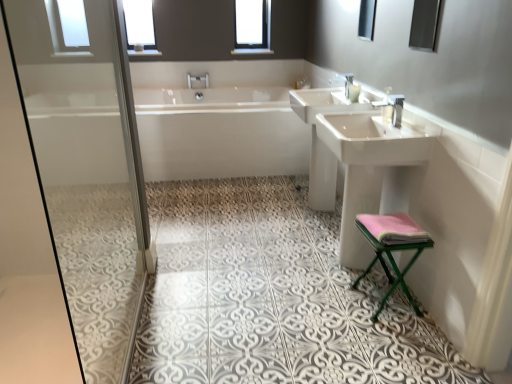
The height and width of the screenshot is (384, 512). Describe the element at coordinates (362, 167) in the screenshot. I see `white glossy sink at right, acting as the first sink starting from the front` at that location.

I want to click on matte glass mirror at upper right, which is counted as the second mirror, starting from the back, so click(425, 25).

How much space does white glass window at upper left, the first window when ordered from left to right, occupy horizontally?

white glass window at upper left, the first window when ordered from left to right, is 1.34 inches wide.

What are the coordinates of `silver metallic tap at upper center, the 1th tap in the right-to-left sequence` in the screenshot? It's located at (391, 108).

This screenshot has width=512, height=384. What do you see at coordinates (391, 108) in the screenshot?
I see `silver metallic tap at upper center, the first tap in the front-to-back sequence` at bounding box center [391, 108].

This screenshot has width=512, height=384. In order to click on white glossy sink at right, acting as the first sink starting from the front in this screenshot , I will do `click(362, 167)`.

From a real-world perspective, is silver metallic tap at upper center, which ranks as the 2th tap in left-to-right order, on top of clear glass window at upper center, the 1th window from the right?

Incorrect, from a real-world perspective, silver metallic tap at upper center, which ranks as the 2th tap in left-to-right order, is lower than clear glass window at upper center, the 1th window from the right.

Are silver metallic tap at upper center, which ranks as the 2th tap in left-to-right order, and clear glass window at upper center, marked as the 2th window in a left-to-right arrangement, located far from each other?

Yes, silver metallic tap at upper center, which ranks as the 2th tap in left-to-right order, and clear glass window at upper center, marked as the 2th window in a left-to-right arrangement, are located far from each other.

Is silver metallic tap at upper center, which is the 1th tap in bottom-to-top order, oriented away from clear glass window at upper center, the 1th window from the right?

No.

Is silver metallic tap at upper center, the first tap in the front-to-back sequence, shorter than clear glass window at upper center, the 1th window from the right?

Yes.

Locate an element on the screen. This screenshot has height=384, width=512. mirror located behind the silver metallic tap at upper center, which ranks as the 2th tap in left-to-right order is located at coordinates (367, 19).

Is silver metallic tap at upper center, positioned as the 2th tap in top-to-bottom order, facing towards glossy glass mirror at upper center, which is the first mirror in left-to-right order?

No, silver metallic tap at upper center, positioned as the 2th tap in top-to-bottom order, does not turn towards glossy glass mirror at upper center, which is the first mirror in left-to-right order.

What's the angular difference between silver metallic tap at upper center, the 1th tap in the right-to-left sequence, and glossy glass mirror at upper center, positioned as the first mirror in back-to-front order,'s facing directions?

silver metallic tap at upper center, the 1th tap in the right-to-left sequence, and glossy glass mirror at upper center, positioned as the first mirror in back-to-front order, are facing 0.678 degrees away from each other.

Which point is more forward, (396, 281) or (369, 6)?

Point (396, 281)

Considering the relative sizes of pink fabric stool at lower right and glossy glass mirror at upper center, which is the first mirror in left-to-right order, in the image provided, is pink fabric stool at lower right wider than glossy glass mirror at upper center, which is the first mirror in left-to-right order,?

Indeed, pink fabric stool at lower right has a greater width compared to glossy glass mirror at upper center, which is the first mirror in left-to-right order.

Between pink fabric stool at lower right and glossy glass mirror at upper center, the first mirror viewed from the top, which one has smaller size?

glossy glass mirror at upper center, the first mirror viewed from the top.

From the picture: From a real-world perspective, relative to glossy glass mirror at upper center, marked as the second mirror in a bottom-to-top arrangement, is pink fabric stool at lower right vertically above or below?

In terms of real-world spatial position, pink fabric stool at lower right is below glossy glass mirror at upper center, marked as the second mirror in a bottom-to-top arrangement.

Considering the relative sizes of glossy glass mirror at upper center, which ranks as the 2th mirror in right-to-left order, and pink fabric stool at lower right in the image provided, is glossy glass mirror at upper center, which ranks as the 2th mirror in right-to-left order, thinner than pink fabric stool at lower right?

Correct, the width of glossy glass mirror at upper center, which ranks as the 2th mirror in right-to-left order, is less than that of pink fabric stool at lower right.

Between glossy glass mirror at upper center, marked as the second mirror in a bottom-to-top arrangement, and pink fabric stool at lower right, which one has larger size?

With larger size is pink fabric stool at lower right.

Would you say glossy glass mirror at upper center, the first mirror viewed from the top, is to the left or to the right of pink fabric stool at lower right in the picture?

In the image, glossy glass mirror at upper center, the first mirror viewed from the top, appears on the right side of pink fabric stool at lower right.

From a real-world perspective, between white textured tile at center and silver metallic tap at upper center, positioned as the 2th tap in top-to-bottom order, who is vertically lower?

From a 3D spatial view, white textured tile at center is below.

In the scene shown: Is white textured tile at center bigger than silver metallic tap at upper center, the 1th tap in the right-to-left sequence?

Yes.

Considering the relative sizes of white textured tile at center and silver metallic tap at upper center, which appears as the second tap when viewed from the back, in the image provided, is white textured tile at center taller than silver metallic tap at upper center, which appears as the second tap when viewed from the back,?

No.

In terms of height, does white glossy sink at center, arranged as the 2th sink when viewed from the front, look taller or shorter compared to clear glass window at upper center, the 1th window from the right?

Clearly, white glossy sink at center, arranged as the 2th sink when viewed from the front, is taller compared to clear glass window at upper center, the 1th window from the right.

Considering the positions of objects white glossy sink at center, arranged as the 2th sink when viewed from the front, and clear glass window at upper center, the 1th window from the right, in the image provided, who is more to the right, white glossy sink at center, arranged as the 2th sink when viewed from the front, or clear glass window at upper center, the 1th window from the right,?

From the viewer's perspective, white glossy sink at center, arranged as the 2th sink when viewed from the front, appears more on the right side.

From the image's perspective, is white glossy sink at center, arranged as the first sink when viewed from the back, under clear glass window at upper center, the 1th window from the right?

Correct, white glossy sink at center, arranged as the first sink when viewed from the back, appears lower than clear glass window at upper center, the 1th window from the right, in the image.

Choose the correct answer: Is white glossy sink at center, arranged as the first sink when viewed from the back, inside clear glass window at upper center, marked as the 2th window in a left-to-right arrangement, or outside it?

white glossy sink at center, arranged as the first sink when viewed from the back, is not inside clear glass window at upper center, marked as the 2th window in a left-to-right arrangement, it's outside.

From a real-world perspective, is pink fabric stool at lower right positioned above or below silver metallic tap at upper center, arranged as the 2th tap when ordered from the bottom?

pink fabric stool at lower right is situated lower than silver metallic tap at upper center, arranged as the 2th tap when ordered from the bottom, in the real world.

Is point (384, 261) more distant than point (198, 79)?

No, it is in front of (198, 79).

From the image's perspective, would you say pink fabric stool at lower right is positioned over silver metallic tap at upper center, which is the 2th tap from right to left?

No, from the image's perspective, pink fabric stool at lower right is not over silver metallic tap at upper center, which is the 2th tap from right to left.

Which window is the 1st one when counting from the left side of the silver metallic tap at upper center, which appears as the second tap when viewed from the back? Please provide its 2D coordinates.

[(252, 27)]

Where is `tap that appears on the right of glossy glass mirror at upper center, the first mirror viewed from the top`? The image size is (512, 384). tap that appears on the right of glossy glass mirror at upper center, the first mirror viewed from the top is located at coordinates (391, 108).

Considering their positions, is clear glass window at upper center, marked as the 2th window in a left-to-right arrangement, positioned closer to pink fabric stool at lower right than white glossy sink at center, arranged as the 2th sink when viewed from the front?

The object closer to pink fabric stool at lower right is white glossy sink at center, arranged as the 2th sink when viewed from the front.

From the image, which object appears to be farther from matte glass mirror at upper right, positioned as the 2th mirror in left-to-right order, white glossy sink at center, arranged as the first sink when viewed from the back, or clear glass window at upper center, the 1th window from the right?

Among the two, clear glass window at upper center, the 1th window from the right, is located further to matte glass mirror at upper right, positioned as the 2th mirror in left-to-right order.

Looking at the image, which one is located closer to white glass window at upper left, the first window when ordered from left to right, silver metallic tap at upper center, the 1th tap in the right-to-left sequence, or white textured tile at center?

white textured tile at center is closer to white glass window at upper left, the first window when ordered from left to right.

Based on their spatial positions, is matte glass mirror at upper right, which is the 1th mirror from bottom to top, or silver metallic tap at upper center, arranged as the 2th tap when ordered from the bottom, closer to white glossy bathtub at center?

silver metallic tap at upper center, arranged as the 2th tap when ordered from the bottom, lies closer to white glossy bathtub at center than the other object.

Estimate the real-world distances between objects in this image. Which object is closer to white glossy bathtub at center, silver metallic tap at upper center, which ranks as the 2th tap in left-to-right order, or white textured tile at center?

Based on the image, white textured tile at center appears to be nearer to white glossy bathtub at center.

From the image, which object appears to be nearer to silver metallic tap at upper center, which is the first tap in left-to-right order, white glossy sink at center, arranged as the 2th sink when viewed from the front, or clear glass window at upper center, marked as the 2th window in a left-to-right arrangement?

Among the two, clear glass window at upper center, marked as the 2th window in a left-to-right arrangement, is located nearer to silver metallic tap at upper center, which is the first tap in left-to-right order.

Looking at the image, which one is located further to pink fabric stool at lower right, silver metallic tap at upper center, which is the 2th tap from right to left, or white glossy bathtub at center?

silver metallic tap at upper center, which is the 2th tap from right to left, is positioned further to the anchor pink fabric stool at lower right.

From the image, which object appears to be nearer to silver metallic tap at upper center, which is the 1th tap in back-to-front order, matte glass mirror at upper right, positioned as the 2th mirror in left-to-right order, or white glass window at upper left, positioned as the 2th window in right-to-left order?

white glass window at upper left, positioned as the 2th window in right-to-left order, is closer to silver metallic tap at upper center, which is the 1th tap in back-to-front order.

This screenshot has height=384, width=512. Find the location of `furniture between white textured tile at center and white glass window at upper left, positioned as the 2th window in right-to-left order, in the front-back direction`. furniture between white textured tile at center and white glass window at upper left, positioned as the 2th window in right-to-left order, in the front-back direction is located at coordinates (392, 248).

Where is `mirror between matte glass mirror at upper right, which is counted as the first mirror, starting from the front, and white glass window at upper left, the first window when ordered from left to right, along the z-axis`? mirror between matte glass mirror at upper right, which is counted as the first mirror, starting from the front, and white glass window at upper left, the first window when ordered from left to right, along the z-axis is located at coordinates (367, 19).

Locate an element on the screen. The width and height of the screenshot is (512, 384). tap between glossy glass mirror at upper center, positioned as the first mirror in back-to-front order, and pink fabric towel at lower right, in the vertical direction is located at coordinates (391, 108).

Locate an element on the screen. Image resolution: width=512 pixels, height=384 pixels. sink between silver metallic tap at upper center, which is the 1th tap in bottom-to-top order, and clear glass window at upper center, the 1th window from the right, in the front-back direction is located at coordinates (320, 140).